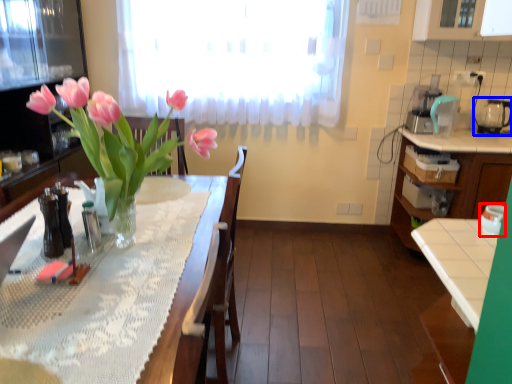
Question: Among these objects, which one is nearest to the camera, appliance (highlighted by a red box) or appliance (highlighted by a blue box)?

Choices:
 (A) appliance
 (B) appliance

Answer: (A)